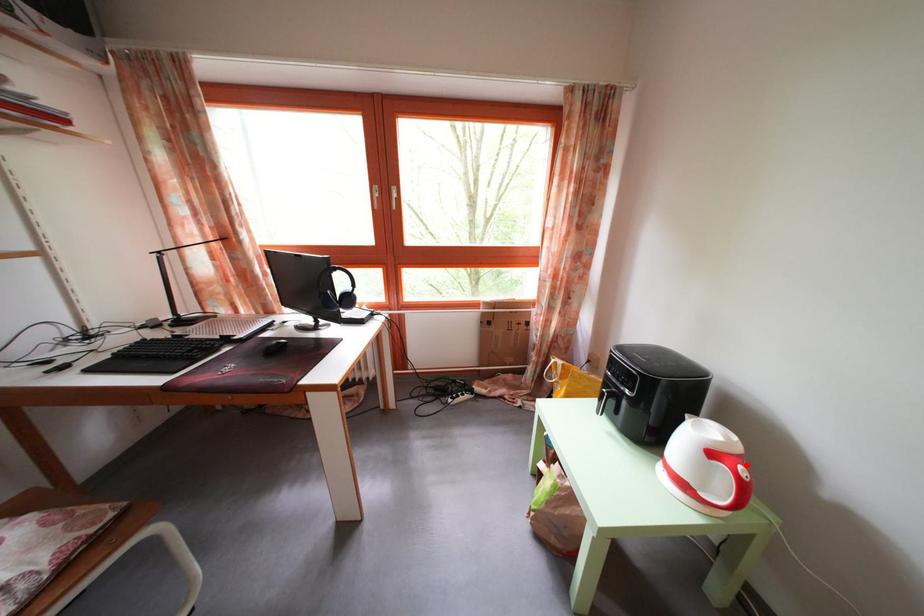
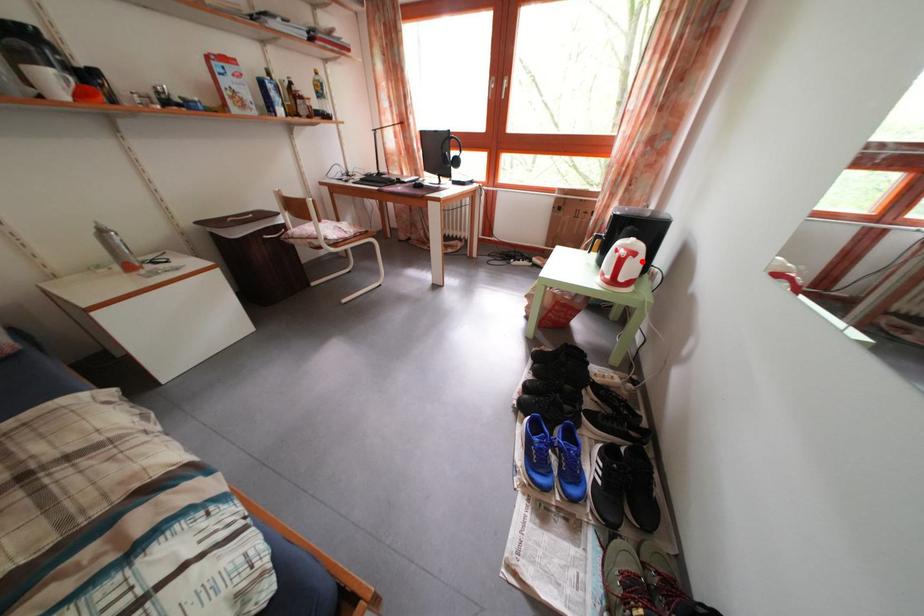
I am providing you with two images of the same scene from different viewpoints. A red point is marked on the first image and another point is marked on the second image. Does the point marked in image1 correspond to the same location as the one in image2?

Yes